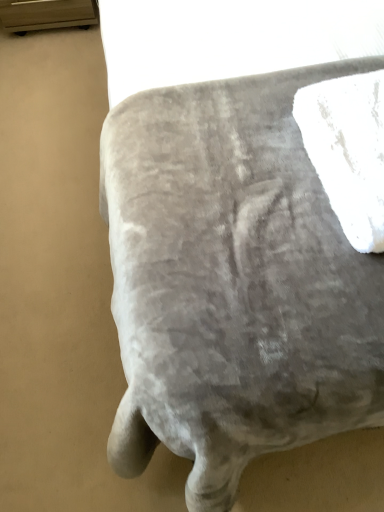
Question: Is point click(367, 126) positioned closer to the camera than point click(152, 219)?

Choices:
 (A) closer
 (B) farther

Answer: (B)

Question: From the image's perspective, relative to velvet ottoman at center, is white fluffy bath towel at upper right above or below?

Choices:
 (A) above
 (B) below

Answer: (B)

Question: In terms of width, does white fluffy bath towel at upper right look wider or thinner when compared to velvet ottoman at center?

Choices:
 (A) wide
 (B) thin

Answer: (B)

Question: Visually, is velvet ottoman at center positioned to the left or to the right of white fluffy bath towel at upper right?

Choices:
 (A) right
 (B) left

Answer: (B)

Question: Considering the positions of point (135, 224) and point (357, 104), is point (135, 224) closer or farther from the camera than point (357, 104)?

Choices:
 (A) closer
 (B) farther

Answer: (A)

Question: Looking at their shapes, would you say velvet ottoman at center is wider or thinner than white fluffy bath towel at upper right?

Choices:
 (A) wide
 (B) thin

Answer: (A)

Question: Is velvet ottoman at center inside the boundaries of white fluffy bath towel at upper right, or outside?

Choices:
 (A) outside
 (B) inside

Answer: (A)